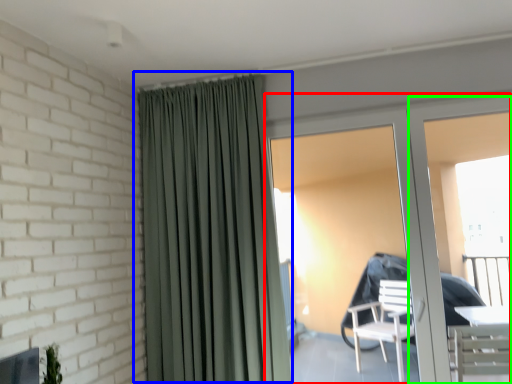
Question: Based on their relative distances, which object is nearer to door (highlighted by a red box)? Choose from curtain (highlighted by a blue box) and screen door (highlighted by a green box).

Choices:
 (A) curtain
 (B) screen door

Answer: (B)